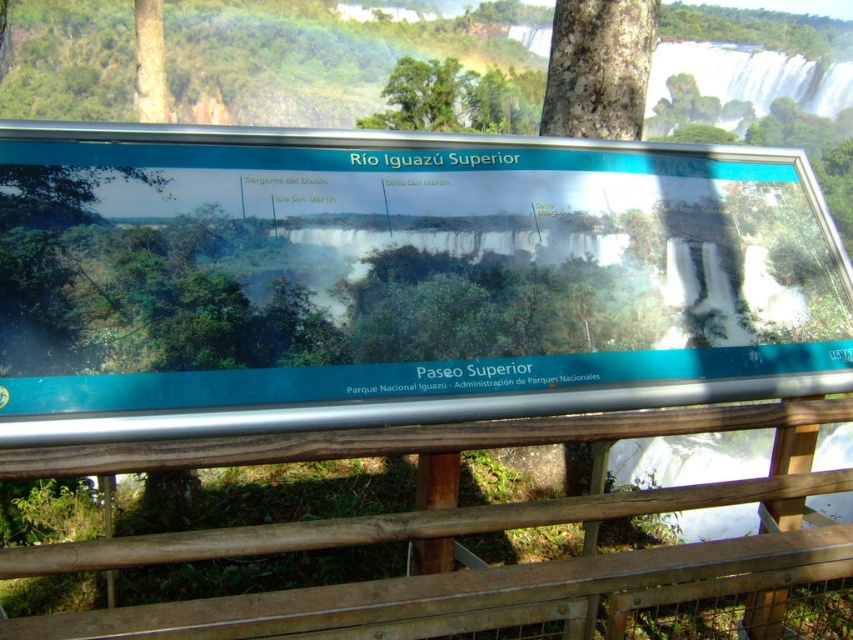
Question: Which of the following is the farthest from the observer?

Choices:
 (A) click(x=695, y=625)
 (B) click(x=589, y=44)

Answer: (B)

Question: Can you confirm if wooden at lower center is wider than brown rough bark tree at upper center?

Choices:
 (A) yes
 (B) no

Answer: (A)

Question: Which point is farther to the camera?

Choices:
 (A) wooden at lower center
 (B) brown rough bark tree at upper center

Answer: (B)

Question: Can you confirm if wooden at lower center is smaller than brown rough bark tree at upper center?

Choices:
 (A) no
 (B) yes

Answer: (A)

Question: Where is wooden at lower center located in relation to brown rough bark tree at upper center in the image?

Choices:
 (A) right
 (B) left

Answer: (B)